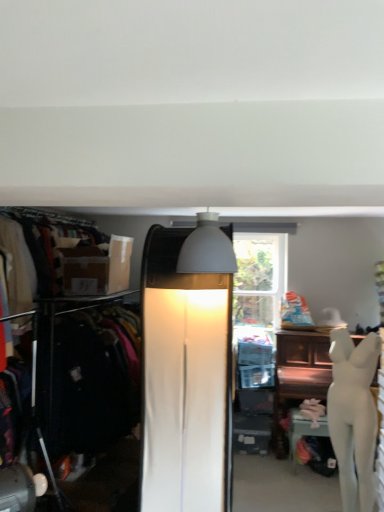
Measure the distance between point (45, 287) and camera.

3.10 meters.

What do you see at coordinates (207, 248) in the screenshot?
I see `white matte lampshade at upper center, which appears as the 1th lamp when viewed from the front` at bounding box center [207, 248].

The height and width of the screenshot is (512, 384). Describe the element at coordinates (353, 415) in the screenshot. I see `white glossy mannequin at lower right` at that location.

The width and height of the screenshot is (384, 512). In order to click on white glossy mannequin at lower right in this screenshot , I will do `click(353, 415)`.

Find the location of a particular element. matte black clothing rack at left is located at coordinates (87, 389).

This screenshot has height=512, width=384. I want to click on white glossy statue at right, so pos(298,376).

The image size is (384, 512). In order to click on matte brown box at left in this screenshot , I will do `click(54, 254)`.

Image resolution: width=384 pixels, height=512 pixels. I want to click on lamp above the matte brown box at left (from the image's perspective), so click(207, 248).

Is matte brown box at left behind white matte lampshade at upper center, the second lamp in the back-to-front sequence?

Yes, it is.

From the image's perspective, is matte brown box at left under white matte lampshade at upper center, acting as the first lamp starting from the top?

Yes, from the image's perspective, matte brown box at left is beneath white matte lampshade at upper center, acting as the first lamp starting from the top.

Who is smaller, matte brown box at left or matte black clothing rack at left?

matte brown box at left is smaller.

Which of these two, matte brown box at left or matte black clothing rack at left, is wider?

matte black clothing rack at left is wider.

From a real-world perspective, is matte brown box at left physically above matte black clothing rack at left?

Indeed, from a real-world perspective, matte brown box at left stands above matte black clothing rack at left.

Would you consider matte brown box at left to be distant from matte black clothing rack at left?

That's not correct — matte brown box at left is a little close to matte black clothing rack at left.

Considering the sizes of objects matte white lamp at center, the second lamp viewed from the top, and white glossy statue at right in the image provided, who is thinner, matte white lamp at center, the second lamp viewed from the top, or white glossy statue at right?

With smaller width is white glossy statue at right.

Considering the sizes of objects matte white lamp at center, which ranks as the 1th lamp in back-to-front order, and white glossy statue at right in the image provided, who is smaller, matte white lamp at center, which ranks as the 1th lamp in back-to-front order, or white glossy statue at right?

Smaller between the two is white glossy statue at right.

Is matte white lamp at center, the second lamp viewed from the top, to the left of white glossy statue at right from the viewer's perspective?

Correct, you'll find matte white lamp at center, the second lamp viewed from the top, to the left of white glossy statue at right.

Is matte white lamp at center, which is the 2th lamp from front to back, not within white glossy statue at right?

Yes, matte white lamp at center, which is the 2th lamp from front to back, is outside of white glossy statue at right.

Who is more distant, white glossy mannequin at lower right or white glossy statue at right?

white glossy statue at right is behind.

Looking at this image, between white glossy mannequin at lower right and white glossy statue at right, which one has smaller width?

Thinner between the two is white glossy mannequin at lower right.

Are white glossy mannequin at lower right and white glossy statue at right far apart?

Yes, white glossy mannequin at lower right and white glossy statue at right are located far from each other.

In the scene shown: Does white glossy mannequin at lower right appear on the left side of white glossy statue at right?

Yes.

Which object is positioned more to the right, matte black clothing rack at left or matte brown box at left?

From the viewer's perspective, matte black clothing rack at left appears more on the right side.

Is matte black clothing rack at left inside or outside of matte brown box at left?

matte black clothing rack at left is not inside matte brown box at left, it's outside.

Is matte black clothing rack at left touching matte brown box at left?

No, matte black clothing rack at left is not with matte brown box at left.

From the white glossy mannequin at lower right, count the 2nd lamp to the left and point to it. Please provide its 2D coordinates.

[(185, 381)]

Considering the points (345, 417) and (204, 412), which point is behind, point (345, 417) or point (204, 412)?

The point (345, 417) is more distant.

In the scene shown: Does white glossy mannequin at lower right touch matte white lamp at center, the second lamp viewed from the top?

white glossy mannequin at lower right and matte white lamp at center, the second lamp viewed from the top, are not in contact.

How distant is white glossy mannequin at lower right from matte white lamp at center, the first lamp in the bottom-to-top sequence?

white glossy mannequin at lower right and matte white lamp at center, the first lamp in the bottom-to-top sequence, are 3.77 feet apart from each other.

Is matte brown box at left bigger than matte white lamp at center, which is the 2th lamp from front to back?

Incorrect, matte brown box at left is not larger than matte white lamp at center, which is the 2th lamp from front to back.

Can you tell me how much matte brown box at left and matte white lamp at center, which ranks as the 1th lamp in back-to-front order, differ in facing direction?

The facing directions of matte brown box at left and matte white lamp at center, which ranks as the 1th lamp in back-to-front order, are 90.5 degrees apart.

You are a GUI agent. You are given a task and a screenshot of the screen. Output one action in this format:
    pyautogui.click(x=<x>, y=<y>)
    Task: Click on the lamp that is the 1st one when counting forward from the matte brown box at left
    
    Given the screenshot: What is the action you would take?
    pyautogui.click(x=185, y=381)

Which of these two, matte brown box at left or matte white lamp at center, the first lamp in the bottom-to-top sequence, is thinner?

Thinner between the two is matte brown box at left.

Locate an element on the screen. clothing on the left side of white matte lampshade at upper center, the second lamp in the back-to-front sequence is located at coordinates click(54, 254).

Locate an element on the screen. This screenshot has height=512, width=384. cabinetry below the matte brown box at left (from the image's perspective) is located at coordinates (87, 389).

Based on their spatial positions, is white glossy statue at right or matte black clothing rack at left closer to white matte lampshade at upper center, which appears as the 1th lamp when viewed from the front?

matte black clothing rack at left is closer to white matte lampshade at upper center, which appears as the 1th lamp when viewed from the front.

Looking at this image, looking at the image, which one is located further to matte brown box at left, white matte lampshade at upper center, the second lamp in the back-to-front sequence, or matte black clothing rack at left?

white matte lampshade at upper center, the second lamp in the back-to-front sequence, lies further to matte brown box at left than the other object.

From the image, which object appears to be nearer to matte black clothing rack at left, matte brown box at left or white matte lampshade at upper center, arranged as the 2th lamp when ordered from the bottom?

Based on the image, matte brown box at left appears to be nearer to matte black clothing rack at left.

Estimate the real-world distances between objects in this image. Which object is closer to white glossy mannequin at lower right, matte black clothing rack at left or matte brown box at left?

Based on the image, matte black clothing rack at left appears to be nearer to white glossy mannequin at lower right.

Which object lies further to the anchor point matte brown box at left, matte white lamp at center, which is the 2th lamp from front to back, or white matte lampshade at upper center, which appears as the 1th lamp when viewed from the front?

Based on the image, white matte lampshade at upper center, which appears as the 1th lamp when viewed from the front, appears to be further to matte brown box at left.

When comparing their distances from white glossy statue at right, does white matte lampshade at upper center, acting as the first lamp starting from the top, or white glossy mannequin at lower right seem further?

white matte lampshade at upper center, acting as the first lamp starting from the top, lies further to white glossy statue at right than the other object.

Which object lies nearer to the anchor point matte white lamp at center, which is the 2th lamp from front to back, white matte lampshade at upper center, arranged as the 2th lamp when ordered from the bottom, or white glossy statue at right?

The object closer to matte white lamp at center, which is the 2th lamp from front to back, is white matte lampshade at upper center, arranged as the 2th lamp when ordered from the bottom.

Considering their positions, is white glossy statue at right positioned closer to matte brown box at left than white matte lampshade at upper center, the second lamp in the back-to-front sequence?

The object closer to matte brown box at left is white matte lampshade at upper center, the second lamp in the back-to-front sequence.

Identify the location of cabinetry situated between matte brown box at left and matte white lamp at center, which ranks as the 1th lamp in back-to-front order, from left to right. The width and height of the screenshot is (384, 512). (87, 389).

What are the coordinates of `cabinetry between matte brown box at left and white glossy mannequin at lower right` in the screenshot? It's located at (87, 389).

Locate an element on the screen. The image size is (384, 512). lamp between white matte lampshade at upper center, arranged as the 2th lamp when ordered from the bottom, and white glossy statue at right, along the z-axis is located at coordinates (185, 381).

Where is `cabinetry located between matte brown box at left and white matte lampshade at upper center, the second lamp in the back-to-front sequence, in the left-right direction`? This screenshot has height=512, width=384. cabinetry located between matte brown box at left and white matte lampshade at upper center, the second lamp in the back-to-front sequence, in the left-right direction is located at coordinates (87, 389).